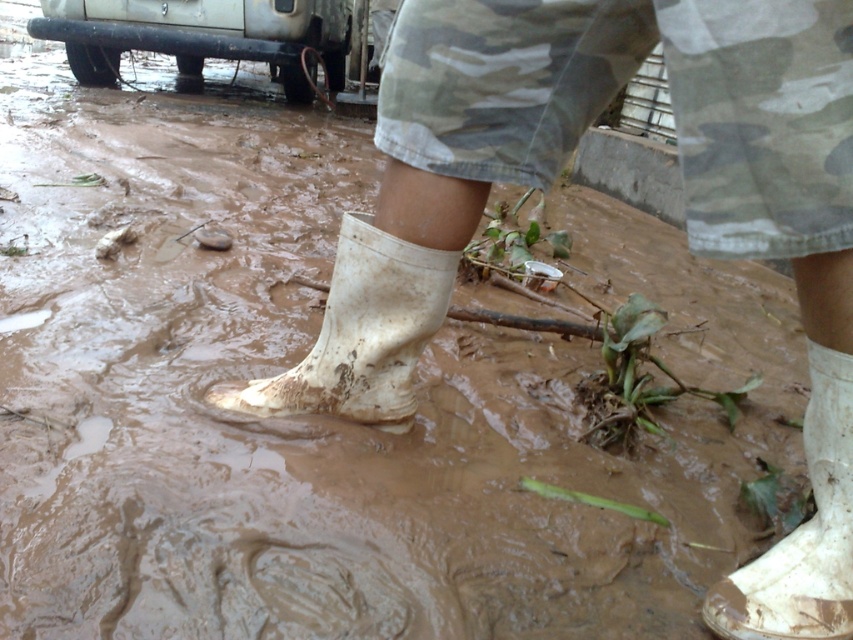
You are a photographer trying to capture the white matte boot at lower right and the silver metallic bumper at upper left in the same frame. Based on their positions, do you think you can include both in a single photo without moving the camera?

The white matte boot at lower right is positioned under the silver metallic bumper at upper left, so yes, you can include both in a single photo without moving the camera because the boot is directly beneath the bumper.